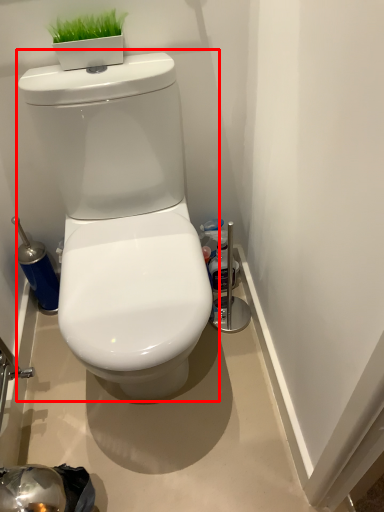
Question: In this image, where is toilet (annotated by the red box) located relative to bottle?

Choices:
 (A) right
 (B) left

Answer: (B)